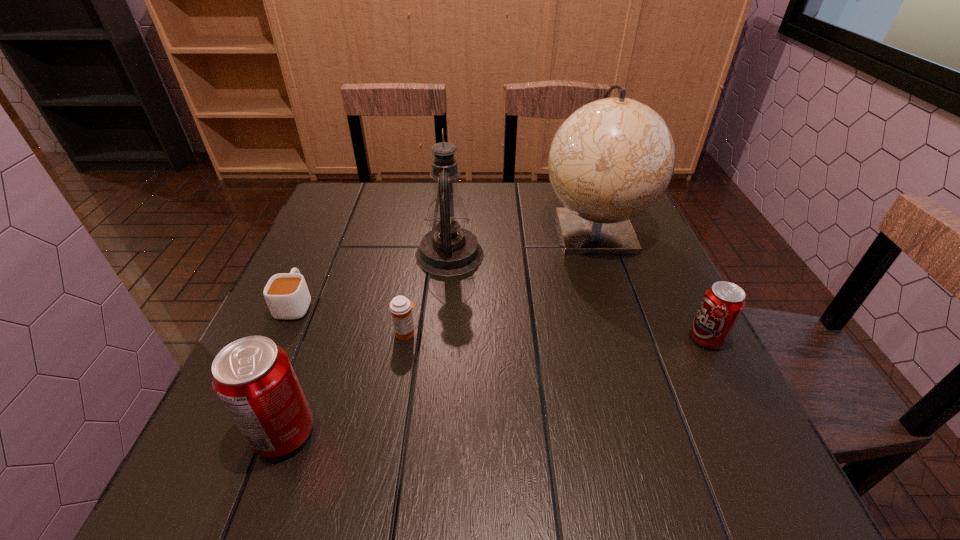
This screenshot has height=540, width=960. Identify the location of vacant space at the near right corner of the desktop. (678, 437).

Image resolution: width=960 pixels, height=540 pixels. I want to click on empty space between the oil lamp and the medicine, so click(428, 294).

This screenshot has height=540, width=960. Find the location of `free point between the oil lamp and the shorter soda`. free point between the oil lamp and the shorter soda is located at coordinates (578, 296).

At what (x,y) coordinates should I click in order to perform the action: click on vacant space that is in between the second shortest object and the shortest object. Please return your answer as a coordinate pair (x, y). Looking at the image, I should click on (351, 318).

Find the location of a particular element. Image resolution: width=960 pixels, height=540 pixels. free space between the globe and the left soda is located at coordinates (439, 332).

This screenshot has height=540, width=960. Find the location of `free point between the medicine and the farther soda`. free point between the medicine and the farther soda is located at coordinates point(556,336).

Locate an element on the screen. This screenshot has height=540, width=960. free spot between the oil lamp and the shortest object is located at coordinates (372, 279).

Locate an element on the screen. The width and height of the screenshot is (960, 540). free space between the globe and the second shortest object is located at coordinates (500, 281).

Find the location of a particular element. unoccupied area between the globe and the oil lamp is located at coordinates (522, 242).

Locate an element on the screen. free space that is in between the fourth shortest object and the globe is located at coordinates (439, 332).